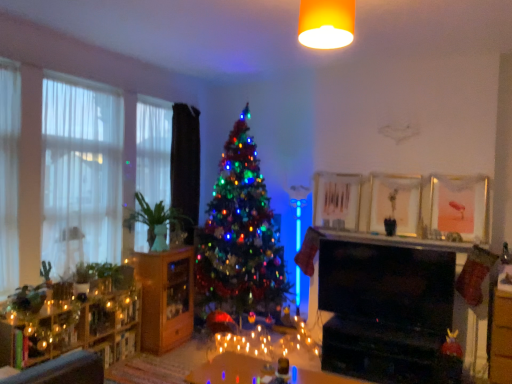
The width and height of the screenshot is (512, 384). What are the coordinates of `free space above white sheer curtain at left, arranged as the 1th window when viewed from the right (from a real-world perspective)` in the screenshot? It's located at (153, 97).